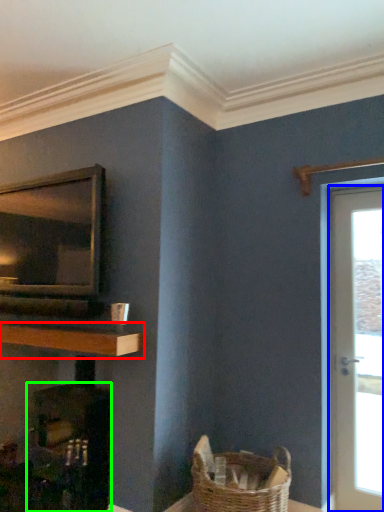
Question: Which is farther away from shelf (highlighted by a red box)? door (highlighted by a blue box) or fireplace (highlighted by a green box)?

Choices:
 (A) door
 (B) fireplace

Answer: (A)